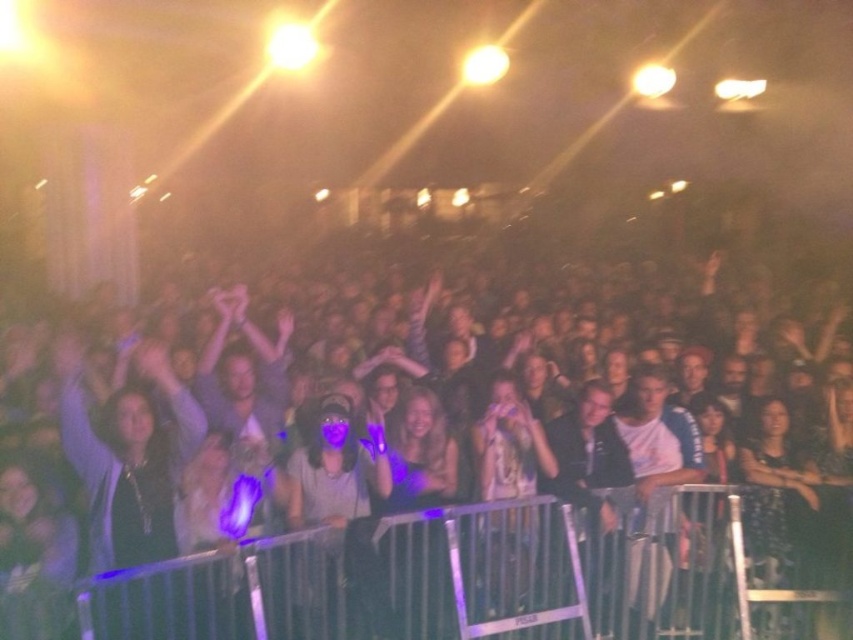
You are standing at the back of the concert venue and want to see the matte purple shirt at center. The matte black crowd at center is blocking your view. Can you move around them to get a better look?

The matte black crowd at center is closer to the viewer than the matte purple shirt at center, so moving around them might not be possible as they are already in front of the shirt from your perspective.

You are a photographer at the concert and want to capture both the matte black crowd at center and the matte purple shirt at center in a single frame. Which object should you focus on first to ensure both are in the frame?

The matte black crowd at center is wider than the matte purple shirt at center, so focusing on the matte black crowd at center first will ensure both objects are within the frame.